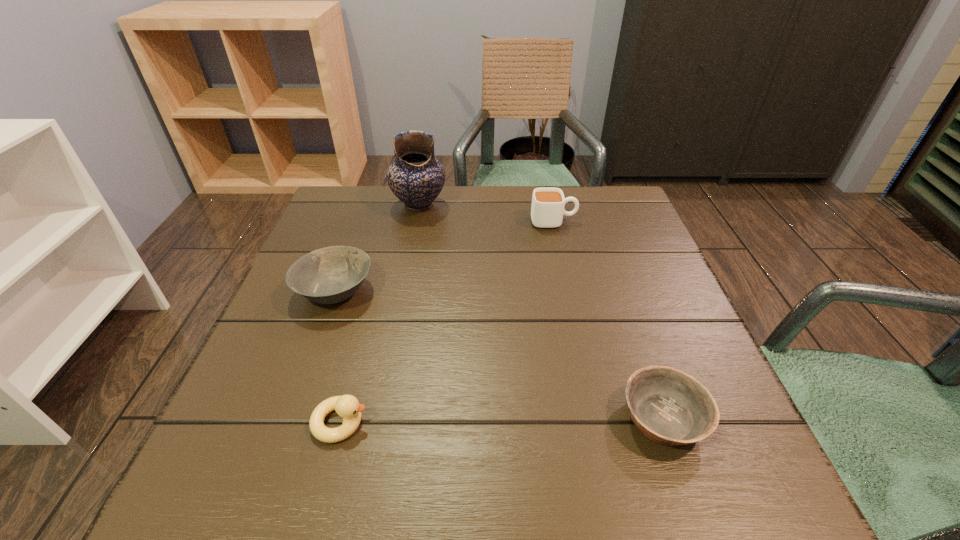
You are a GUI agent. You are given a task and a screenshot of the screen. Output one action in this format:
    pyautogui.click(x=<x>, y=<y>)
    Task: Click on the free space that satisfies the following two spatial constraints: 1. on the side with the handle of the nearer bowl; 2. on the left side of the second tallest object
    
    Given the screenshot: What is the action you would take?
    pyautogui.click(x=598, y=418)